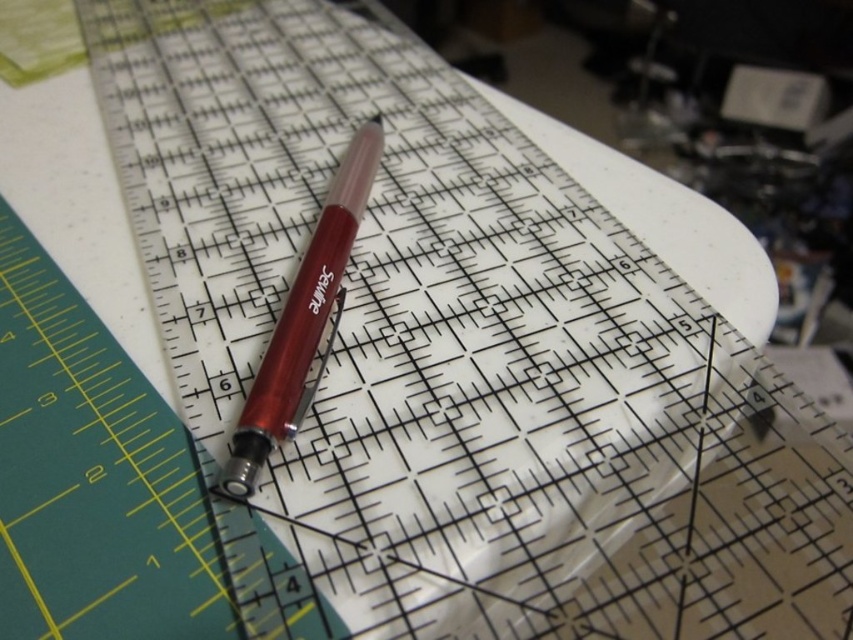
Question: Which point is closer to the camera?

Choices:
 (A) translucent plastic ruler at upper center
 (B) metallic red pen at center

Answer: (A)

Question: Is translucent plastic ruler at upper center positioned behind metallic red pen at center?

Choices:
 (A) no
 (B) yes

Answer: (A)

Question: Is translucent plastic ruler at upper center positioned before metallic red pen at center?

Choices:
 (A) yes
 (B) no

Answer: (A)

Question: Can you confirm if translucent plastic ruler at upper center is smaller than metallic red pen at center?

Choices:
 (A) no
 (B) yes

Answer: (A)